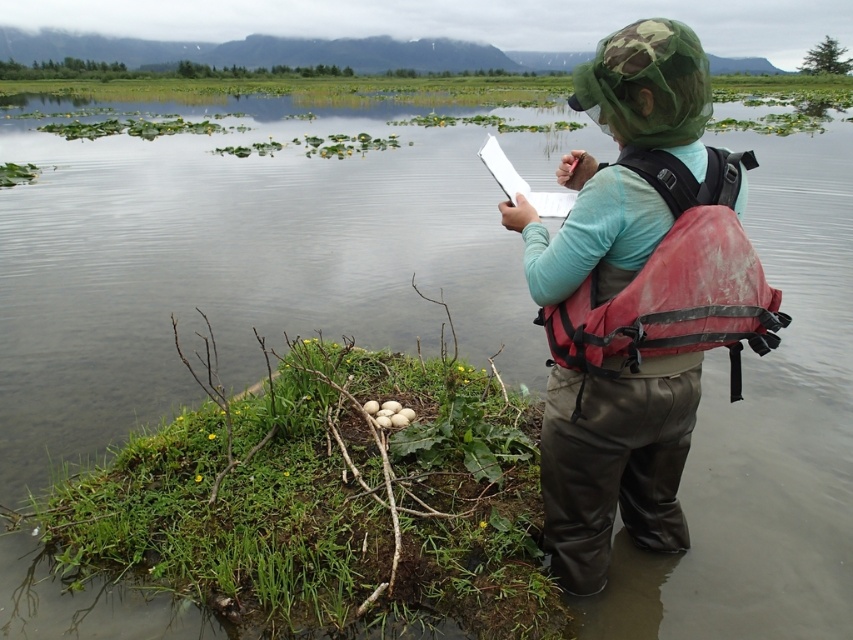
Question: Is matte green hat at upper center smaller than red nylon life jacket at back?

Choices:
 (A) yes
 (B) no

Answer: (B)

Question: Where is matte green hat at upper center located in relation to red nylon life jacket at back in the image?

Choices:
 (A) above
 (B) below

Answer: (B)

Question: Does matte green hat at upper center appear over red nylon life jacket at back?

Choices:
 (A) yes
 (B) no

Answer: (B)

Question: Which object appears closest to the camera in this image?

Choices:
 (A) red nylon life jacket at back
 (B) matte green hat at upper center

Answer: (B)